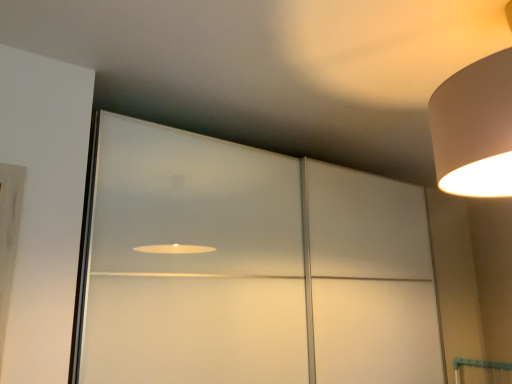
In order to click on transparent glass door at center in this screenshot , I will do `click(252, 267)`.

Describe the element at coordinates (252, 267) in the screenshot. I see `transparent glass door at center` at that location.

Measure the distance between point (284, 200) and camera.

The depth of point (284, 200) is 6.61 feet.

At what (x,y) coordinates should I click in order to perform the action: click on transparent glass door at center. Please return your answer as a coordinate pair (x, y). Image resolution: width=512 pixels, height=384 pixels. Looking at the image, I should click on (252, 267).